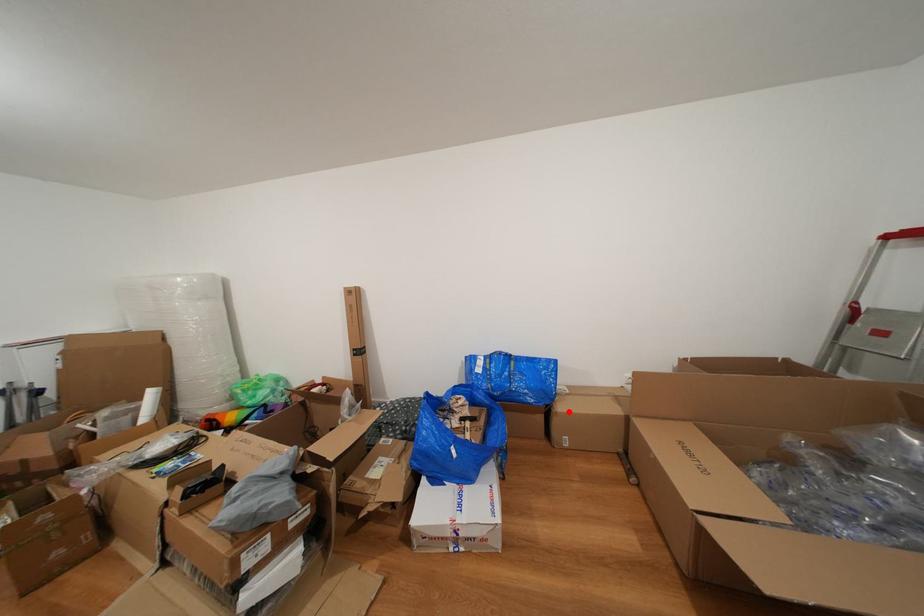
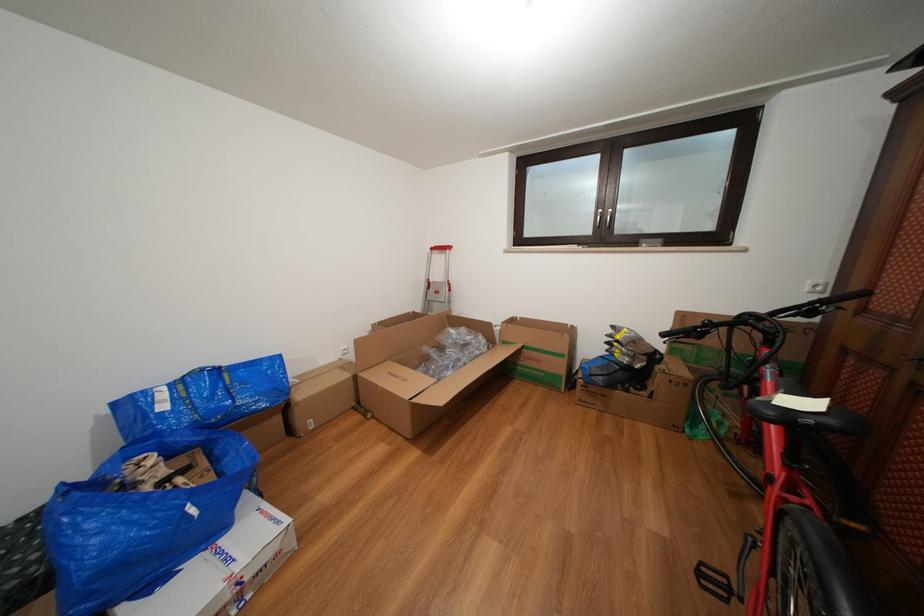
The point at the highlighted location is marked in the first image. Where is the corresponding point in the second image?

(309, 400)